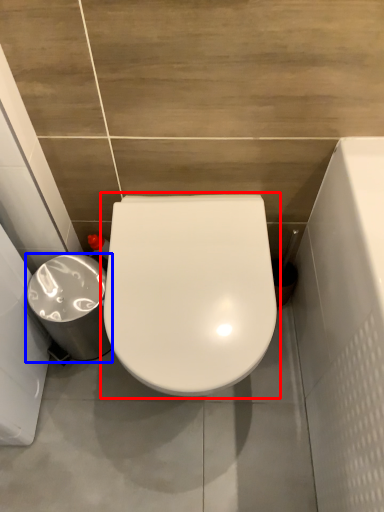
Question: Among these objects, which one is nearest to the camera, toilet (highlighted by a red box) or porcelain (highlighted by a blue box)?

Choices:
 (A) toilet
 (B) porcelain

Answer: (A)